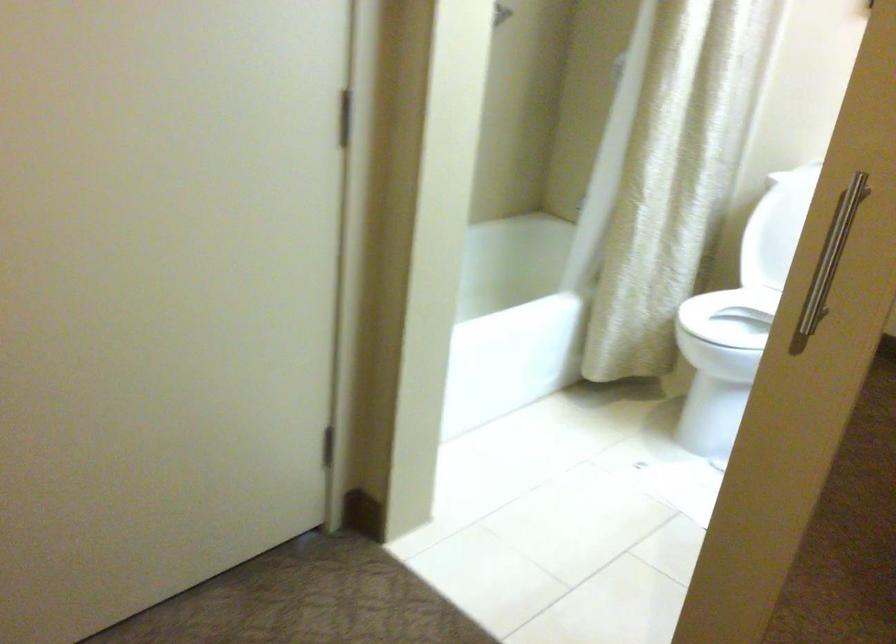
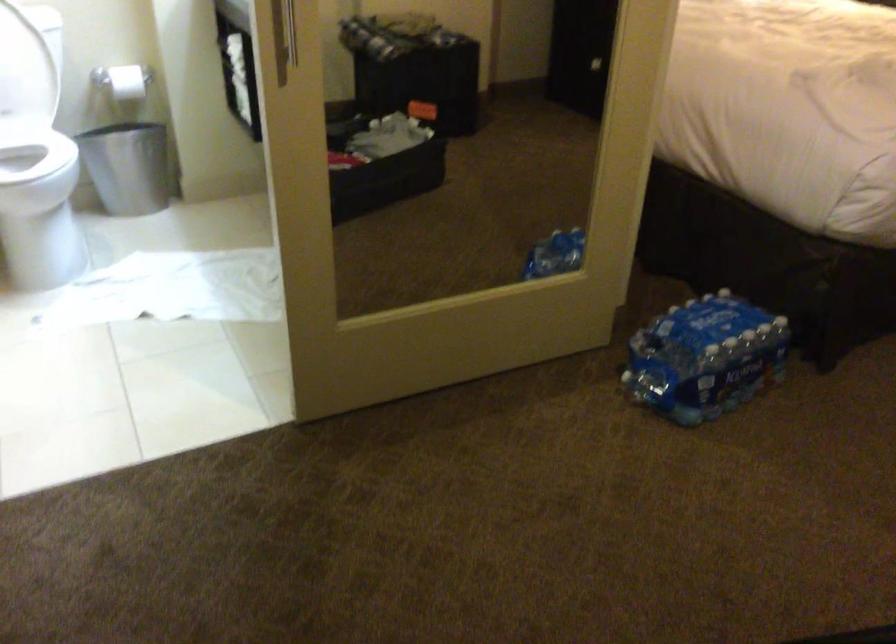
Based on the continuous images, in which direction is the camera rotating?

The rotation direction of the camera is right-down.